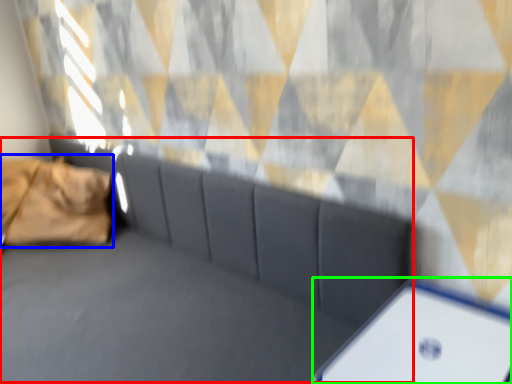
Question: Which object is the farthest from couch (highlighted by a red box)? Choose among these: pillow (highlighted by a blue box) or furniture (highlighted by a green box).

Choices:
 (A) pillow
 (B) furniture

Answer: (A)